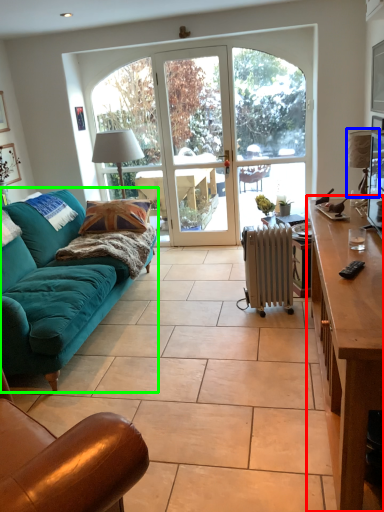
Question: Considering the real-world distances, which object is farthest from desk (highlighted by a red box)? lamp (highlighted by a blue box) or studio couch (highlighted by a green box)?

Choices:
 (A) lamp
 (B) studio couch

Answer: (B)